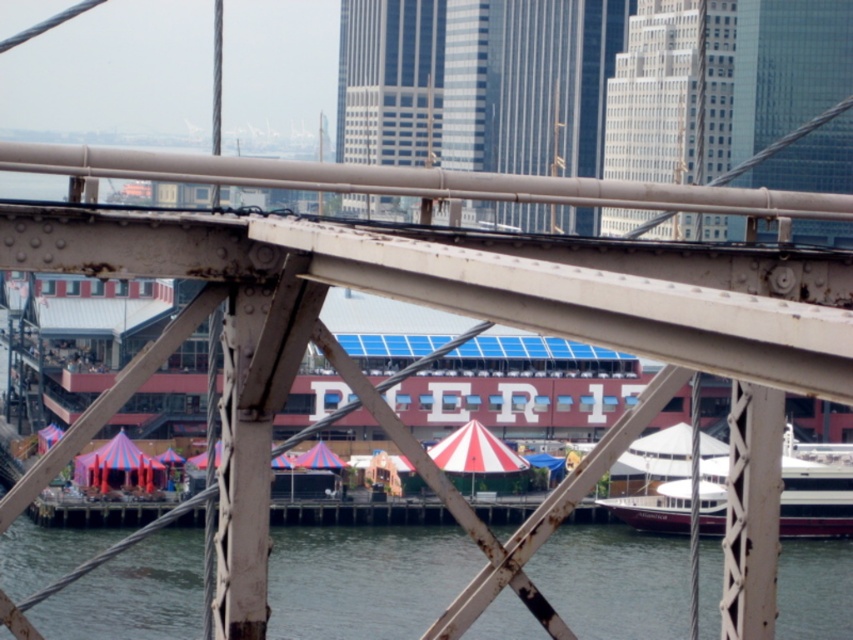
Is clear water at lower center positioned in front of white glossy boat at lower right?

No, it is behind white glossy boat at lower right.

Image resolution: width=853 pixels, height=640 pixels. I want to click on clear water at lower center, so click(x=364, y=579).

Does point (665, 602) come farther from viewer compared to point (631, 525)?

No.

The width and height of the screenshot is (853, 640). Find the location of `clear water at lower center`. clear water at lower center is located at coordinates (364, 579).